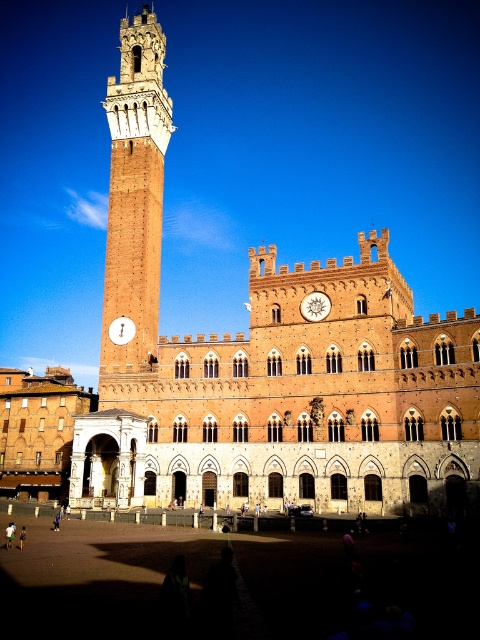
Looking at this image, can you confirm if brown brick bell tower at left is taller than white glossy clock at center?

Yes, brown brick bell tower at left is taller than white glossy clock at center.

Does brown brick bell tower at left lie in front of white glossy clock at center?

Yes, it is in front of white glossy clock at center.

I want to click on brown brick bell tower at left, so coord(134,193).

Is brown brick bell tower at left smaller than wooden clock at center?

No.

Which is below, brown brick bell tower at left or wooden clock at center?

wooden clock at center is lower down.

Which is in front, point (165, 49) or point (326, 307)?

Point (326, 307) is in front.

Identify the location of brown brick bell tower at left. The width and height of the screenshot is (480, 640). (134, 193).

Is brown stone building at center smaller than white glossy clock at center?

Incorrect, brown stone building at center is not smaller in size than white glossy clock at center.

Which is above, brown stone building at center or white glossy clock at center?

brown stone building at center is above.

Locate an element on the screen. brown stone building at center is located at coordinates (264, 362).

Where is `brown stone building at center`? The image size is (480, 640). brown stone building at center is located at coordinates (264, 362).